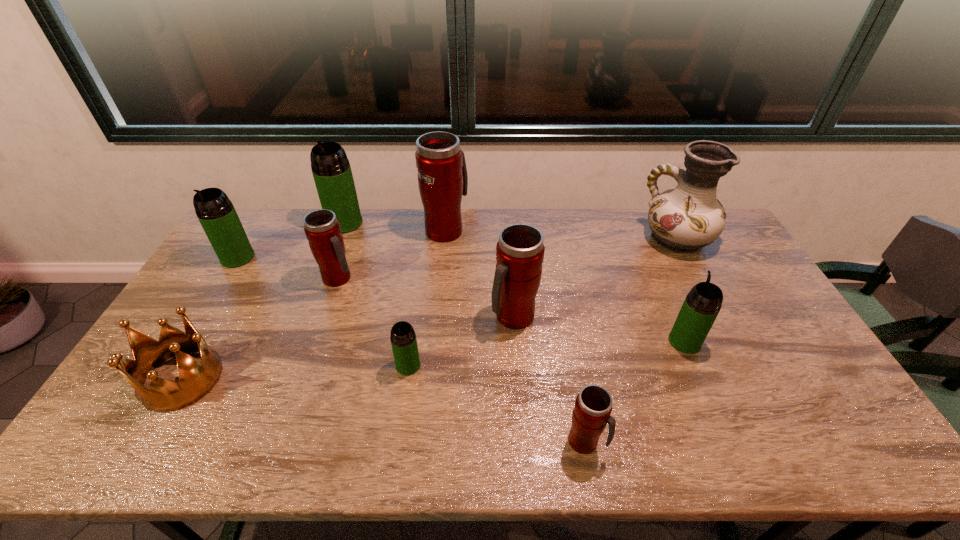
The width and height of the screenshot is (960, 540). Find the location of `free space located 0.190m from the spout of the second farthest green thermos bottle`. free space located 0.190m from the spout of the second farthest green thermos bottle is located at coordinates (205, 310).

Locate an element on the screen. Image resolution: width=960 pixels, height=540 pixels. vacant area situated 0.120m on the side with the handle of the fourth object from right to left is located at coordinates (517, 371).

The image size is (960, 540). What are the coordinates of `vacant area situated 0.130m from the spout of the third farthest green thermos bottle` in the screenshot? It's located at (666, 298).

You are a GUI agent. You are given a task and a screenshot of the screen. Output one action in this format:
    pyautogui.click(x=<x>, y=<y>)
    Task: Click on the vacant space situated from the spout of the third farthest green thermos bottle
    This screenshot has width=960, height=540.
    Given the screenshot: What is the action you would take?
    pyautogui.click(x=672, y=312)

Identify the location of free space located 0.130m from the spout of the third farthest green thermos bottle. The height and width of the screenshot is (540, 960). (666, 298).

Locate an element on the screen. free space located 0.150m on the side with the handle of the second smallest red thermos bottle is located at coordinates (402, 279).

I want to click on vacant space situated on the right of the crown, so click(296, 379).

Where is `vacant space located from the spout of the third green thermos bottle from left to right`? The image size is (960, 540). vacant space located from the spout of the third green thermos bottle from left to right is located at coordinates (396, 453).

This screenshot has height=540, width=960. Identify the location of blank space located on the side with the handle of the nearest thermos bottle. [x=641, y=442].

You are a GUI agent. You are given a task and a screenshot of the screen. Output one action in this format:
    pyautogui.click(x=<x>, y=<y>)
    Task: Click on the vase situated at the far edge
    The width and height of the screenshot is (960, 540).
    Given the screenshot: What is the action you would take?
    (x=684, y=219)